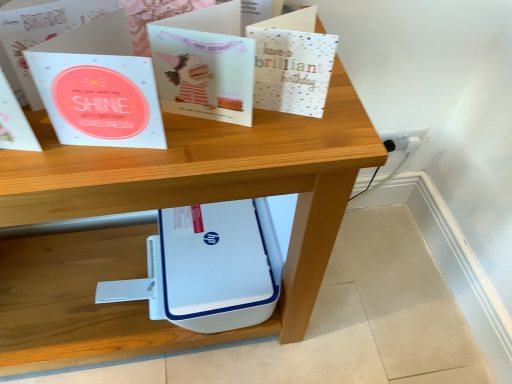
Locate an element on the screen. vacant area to the right of light blue paper at center, which is counted as the third paperback book, starting from the right is located at coordinates (240, 144).